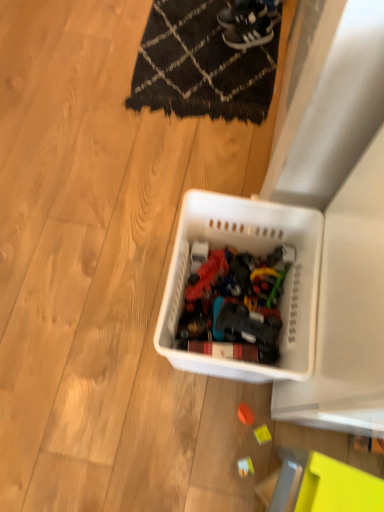
Find the location of `vacant space in front of white leather sneakers at upper center, which is the second footwear from top to bottom`. vacant space in front of white leather sneakers at upper center, which is the second footwear from top to bottom is located at coordinates (238, 70).